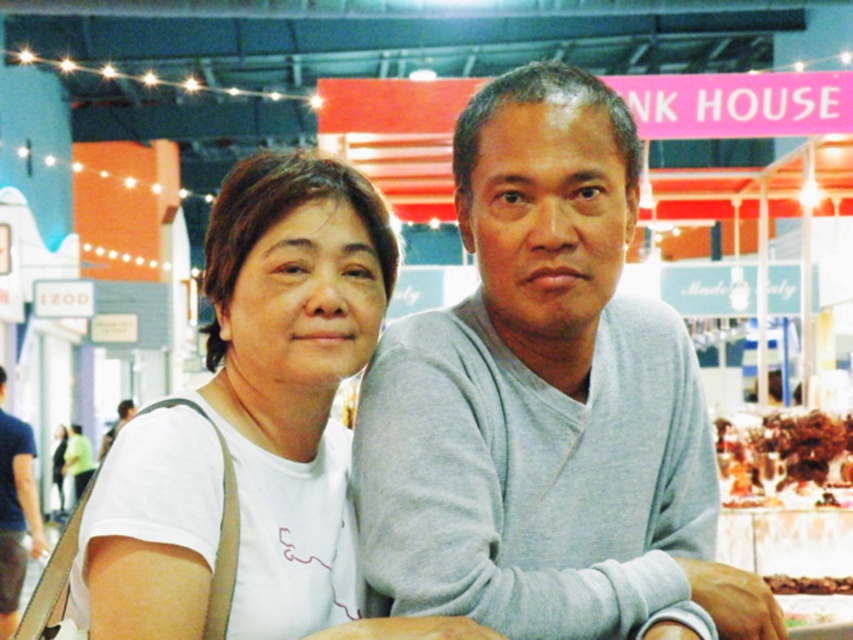
Question: Does gray cotton sweater at center come in front of blue cotton t-shirt at left?

Choices:
 (A) yes
 (B) no

Answer: (A)

Question: Which object is farther from the camera taking this photo?

Choices:
 (A) yellow matte cake at center
 (B) gray cotton sweater at center

Answer: (B)

Question: Considering the real-world distances, which object is closest to the gray cotton sweater at center?

Choices:
 (A) brown crumbly bread at lower right
 (B) yellow matte cake at center
 (C) chocolate cake at center

Answer: (B)

Question: Which point is farther to the camera?

Choices:
 (A) (21, 499)
 (B) (810, 593)
 (C) (792, 416)
 (D) (332, 627)

Answer: (A)

Question: Does gray cotton sweater at center have a smaller size compared to yellow matte cake at center?

Choices:
 (A) no
 (B) yes

Answer: (A)

Question: Can you confirm if brown crumbly bread at lower right is positioned below yellow matte cake at center?

Choices:
 (A) yes
 (B) no

Answer: (A)